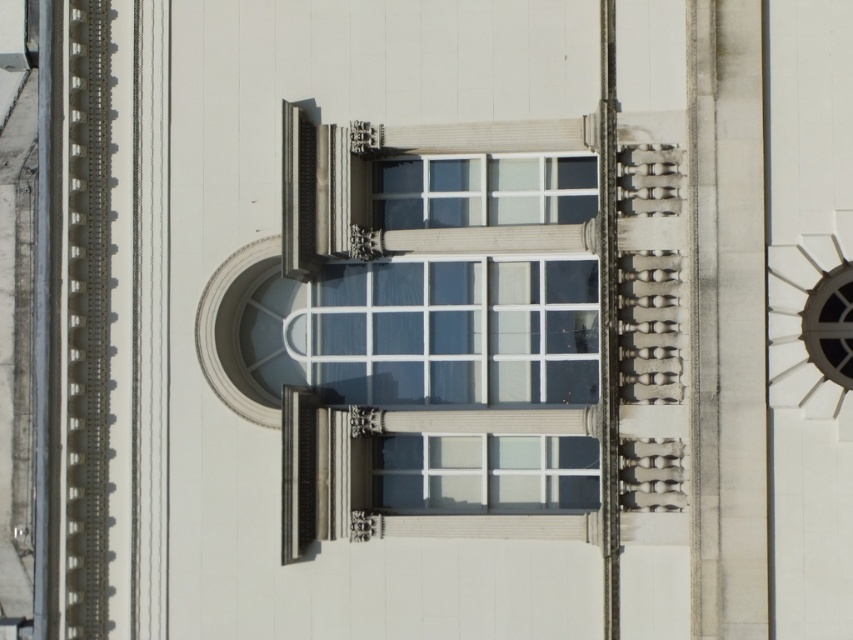
You are an architect assessing the building facade. You need to install a new decorative element that must be wider than the clear glass window at center. Can the metallic silver clock at right be used for this purpose? Please explain.

The clear glass window at center has a lesser width compared to metallic silver clock at right. Therefore, the metallic silver clock at right is wider and can be used as the decorative element since it exceeds the width of the clear glass window at center.

Consider the image. You are standing in front of the building and want to see the metallic silver clock at right. Can you see it through the clear glass window at center?

The metallic silver clock at right is behind the clear glass window at center, so you can see it through the window.

You are an architect designing a new building and want to ensure proper proportions between the clear glass window at center and the metallic silver clock at right. Based on the image, which object should be scaled down to maintain the original design proportions?

The metallic silver clock at right should be scaled down because the clear glass window at center is smaller than the metallic silver clock at right in the original design.